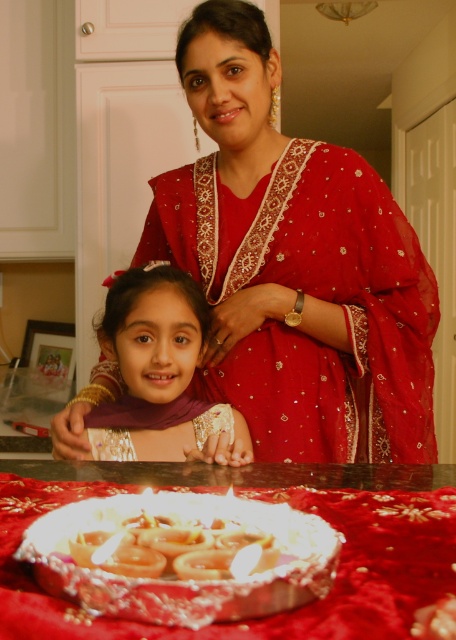
Who is shorter, purple satin hijab at center or shiny golden rings at center?

With less height is shiny golden rings at center.

Can you confirm if purple satin hijab at center is wider than shiny golden rings at center?

Indeed, purple satin hijab at center has a greater width compared to shiny golden rings at center.

This screenshot has width=456, height=640. Identify the location of purple satin hijab at center. pos(161,374).

Is matte red sari at center to the left of purple satin hijab at center from the viewer's perspective?

No, matte red sari at center is not to the left of purple satin hijab at center.

Where is `matte red sari at center`? The width and height of the screenshot is (456, 640). matte red sari at center is located at coordinates (294, 266).

Identify the location of matte red sari at center. Image resolution: width=456 pixels, height=640 pixels. (294, 266).

Who is positioned more to the right, matte red sari at center or shiny golden rings at center?

matte red sari at center

At what (x,y) coordinates should I click in order to perform the action: click on matte red sari at center. Please return your answer as a coordinate pair (x, y). The width and height of the screenshot is (456, 640). Looking at the image, I should click on (294, 266).

Find the location of a particular element. matte red sari at center is located at coordinates (294, 266).